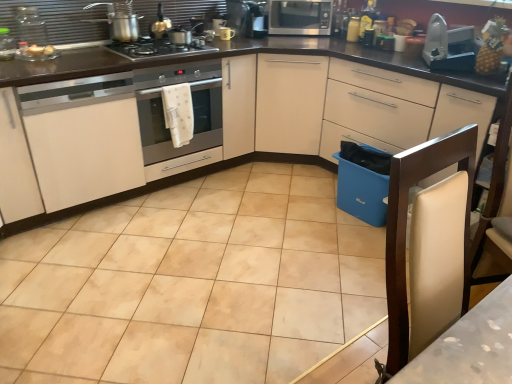
Find the location of `free space to the left of metallic silver toaster at upper center, the 4th appliance viewed from the right`. free space to the left of metallic silver toaster at upper center, the 4th appliance viewed from the right is located at coordinates (205, 40).